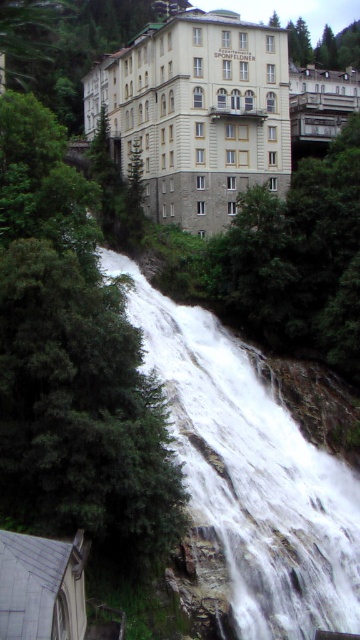
Who is shorter, green leafy tree at left or matte white balcony at upper center?

matte white balcony at upper center is shorter.

Which of these two, green leafy tree at left or matte white balcony at upper center, stands taller?

With more height is green leafy tree at left.

Which is behind, point (18, 316) or point (343, 90)?

Positioned behind is point (343, 90).

You are a GUI agent. You are given a task and a screenshot of the screen. Output one action in this format:
    pyautogui.click(x=<x>, y=<y>)
    Task: Click on the green leafy tree at left
    The width and height of the screenshot is (360, 640).
    Given the screenshot: What is the action you would take?
    pyautogui.click(x=73, y=362)

Does green leafy tree at left come in front of gray slate roof at lower left?

That is False.

From the picture: Who is more forward, [0,340] or [47,627]?

Point [47,627]

Locate an element on the screen. green leafy tree at left is located at coordinates (73, 362).

Looking at this image, who is positioned more to the right, white stone building at center or gray slate roof at lower left?

gray slate roof at lower left

The image size is (360, 640). What are the coordinates of `white stone building at center` in the screenshot? It's located at (196, 113).

At what (x,y) coordinates should I click in order to perform the action: click on white stone building at center. Please return your answer as a coordinate pair (x, y). Image resolution: width=360 pixels, height=640 pixels. Looking at the image, I should click on (196, 113).